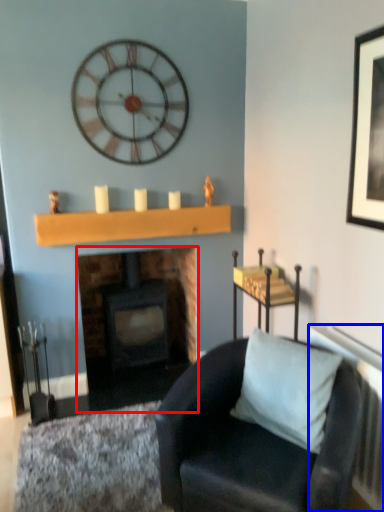
Question: Which object appears closest to the camera in this image, fireplace (highlighted by a red box) or radiator (highlighted by a blue box)?

Choices:
 (A) fireplace
 (B) radiator

Answer: (B)